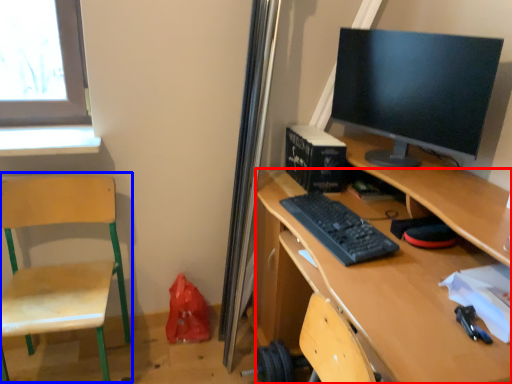
Question: Which of the following is the closest to the observer, desk (highlighted by a red box) or swivel chair (highlighted by a blue box)?

Choices:
 (A) desk
 (B) swivel chair

Answer: (A)